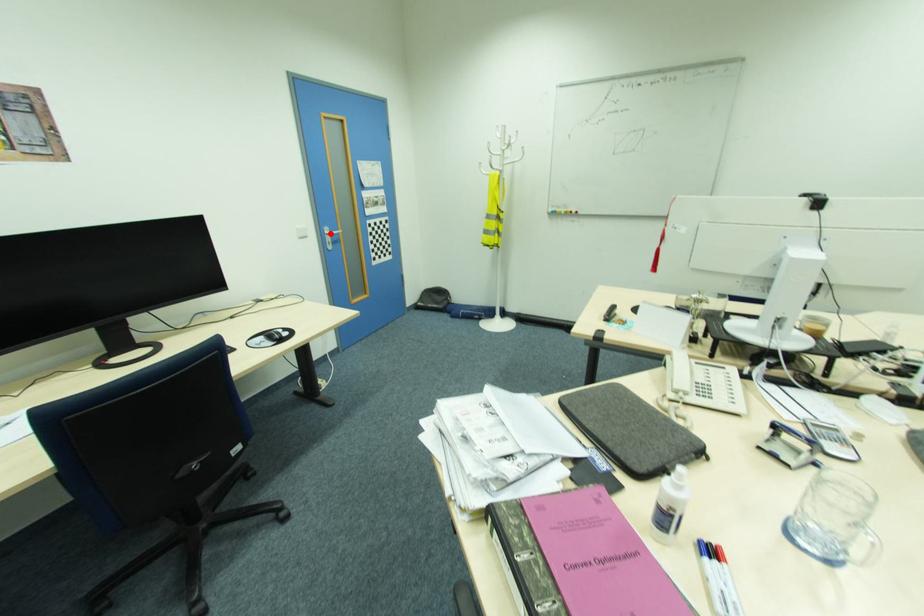
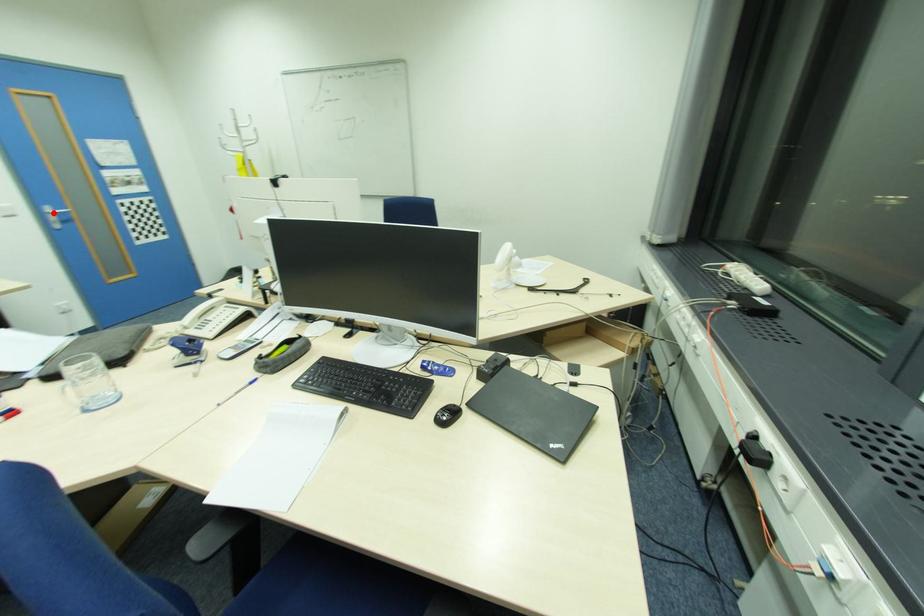
I am providing you with two images of the same scene from different viewpoints. A red point is marked on the first image and another point is marked on the second image. Does the point marked in image1 correspond to the same location as the one in image2?

Yes